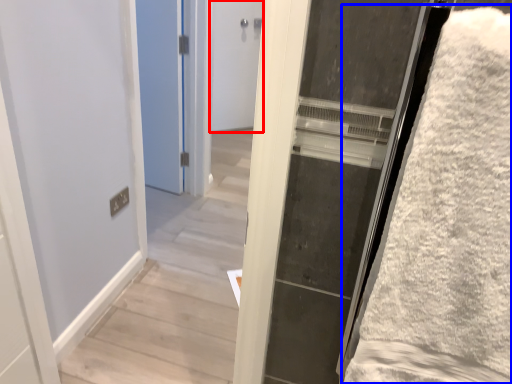
Question: Which of the following is the farthest to the observer, door (highlighted by a red box) or bath towel (highlighted by a blue box)?

Choices:
 (A) door
 (B) bath towel

Answer: (A)